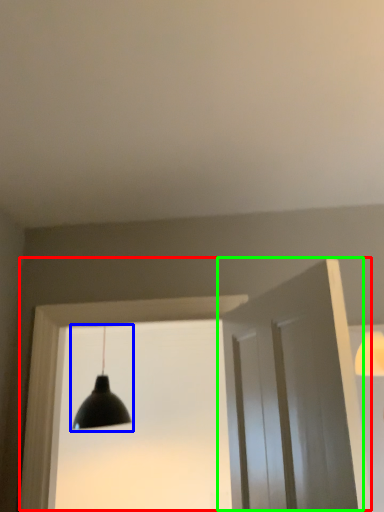
Question: Which is nearer to the window frame (highlighted by a red box)? lamp (highlighted by a blue box) or door (highlighted by a green box).

Choices:
 (A) lamp
 (B) door

Answer: (B)